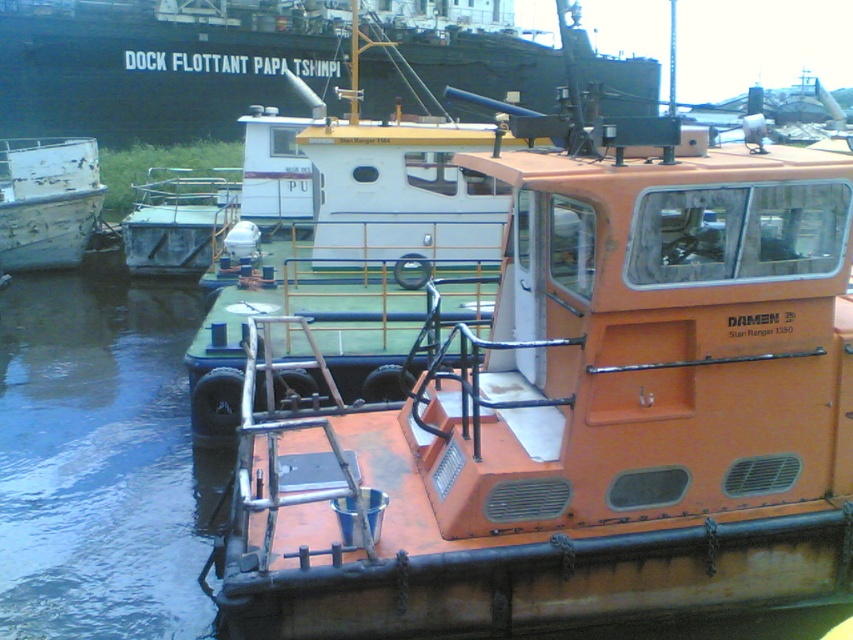
You are a harbor inspector checking the docking positions of two boats. The orange matte boat at center and the white weathered boat at left are both docked in the harbor. Based on their positions, which boat is closer to the right side of the harbor?

The orange matte boat at center is positioned on the right side of the white weathered boat at left, meaning it is closer to the right side of the harbor than the white weathered boat at left.